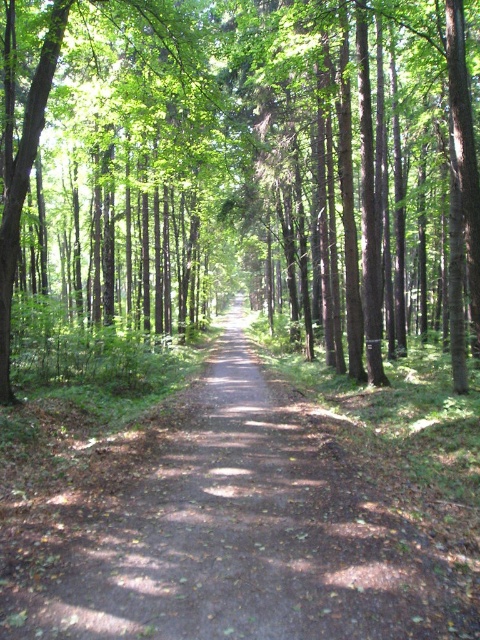
Is green leafy tree at center positioned in front of dirt path at center?

No, green leafy tree at center is behind dirt path at center.

Can you confirm if green leafy tree at center is positioned above dirt path at center?

Yes, green leafy tree at center is above dirt path at center.

Locate an element on the screen. The image size is (480, 640). green leafy tree at center is located at coordinates (243, 164).

Where is `green leafy tree at center`? green leafy tree at center is located at coordinates (243, 164).